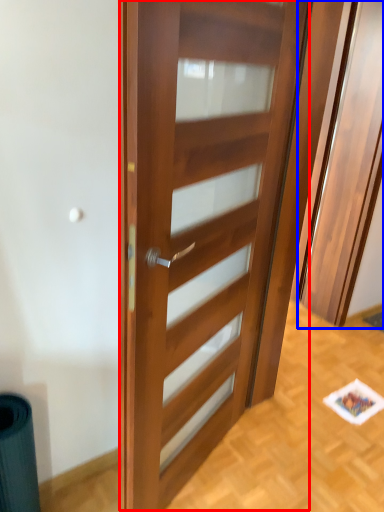
Question: Which point is closer to the camera, door (highlighted by a red box) or elevator (highlighted by a blue box)?

Choices:
 (A) door
 (B) elevator

Answer: (A)